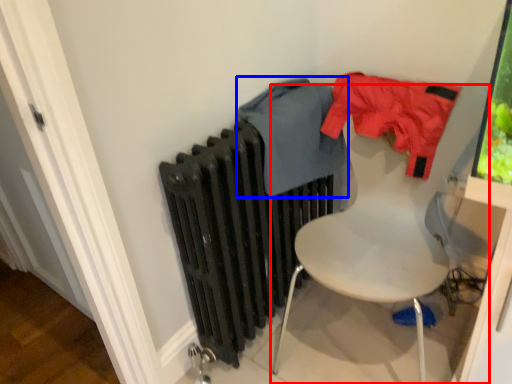
Question: Which object is further to the camera taking this photo, chair (highlighted by a red box) or clothing (highlighted by a blue box)?

Choices:
 (A) chair
 (B) clothing

Answer: (B)